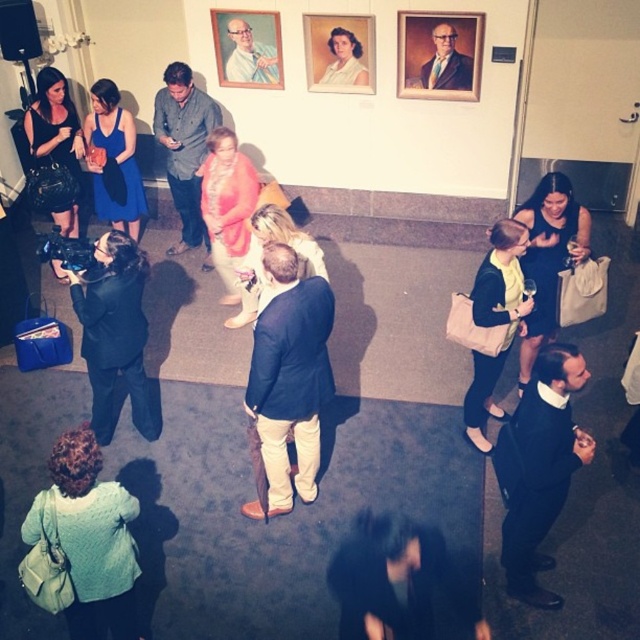
You are standing at the entrance of the gallery and see a point marked at coordinates (83, 545). Based on the scene description, can you determine what object this point is located on?

The point at coordinates (83, 545) is located on the light teal sweater at lower left.

Consider the image. You are at an event and want to approach the dark blue suit at center and the blue satin dress at center. Which one is lower in position?

The dark blue suit at center is positioned under the blue satin dress at center, so the dark blue suit at center is lower.